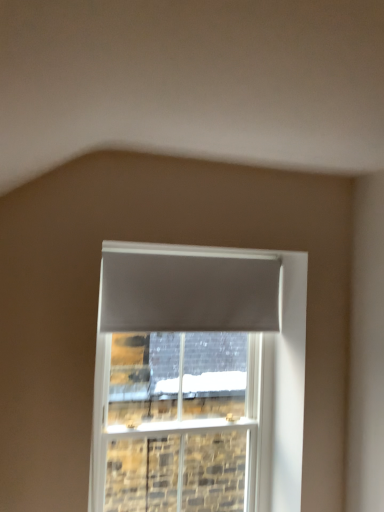
Describe the element at coordinates (188, 289) in the screenshot. This screenshot has width=384, height=512. I see `gray matte curtain at center` at that location.

Locate an element on the screen. gray matte curtain at center is located at coordinates (188, 289).

Locate an element on the screen. gray matte curtain at center is located at coordinates (188, 289).